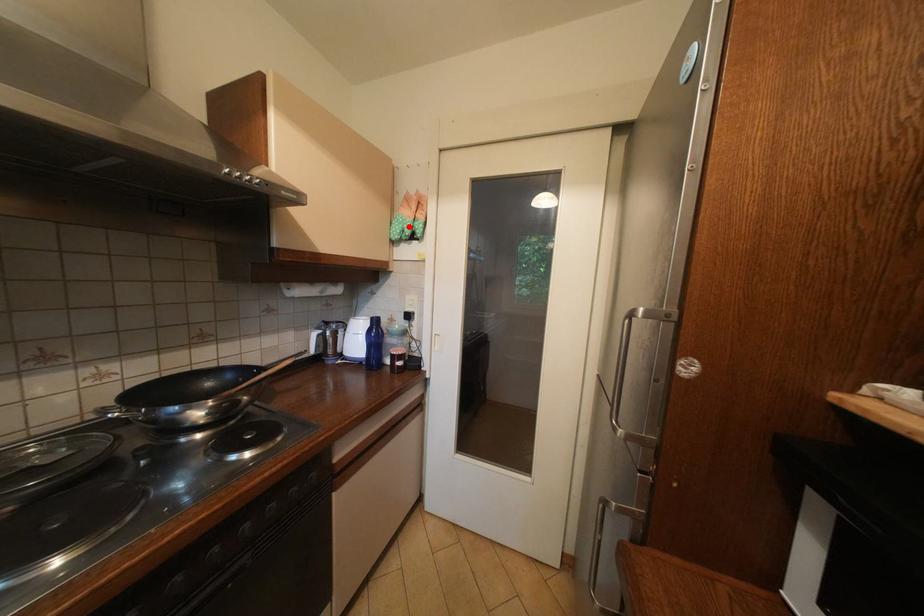
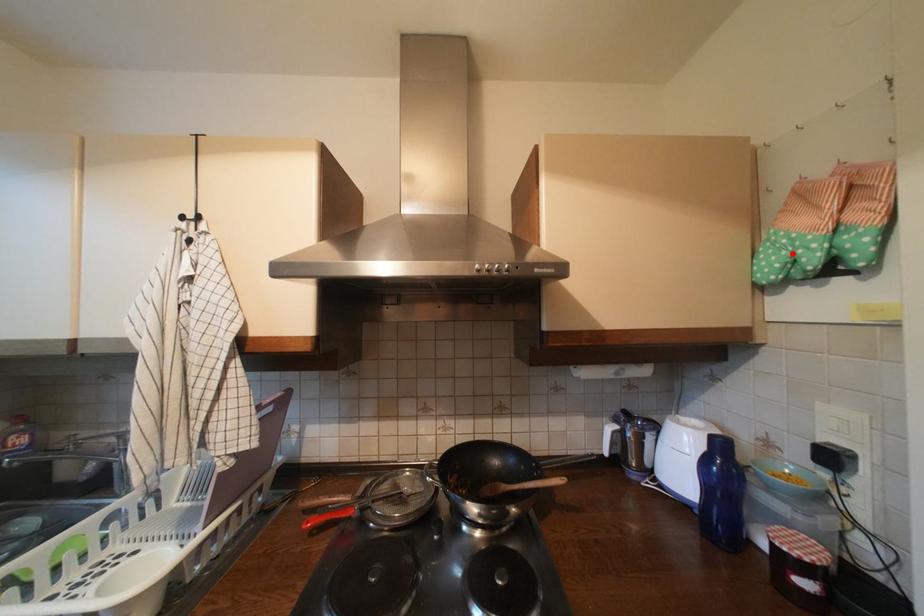
I am providing you with two images of the same scene from different viewpoints. A red point is marked on the first image and another point is marked on the second image. Do the highlighted points in image1 and image2 indicate the same real-world spot?

Yes